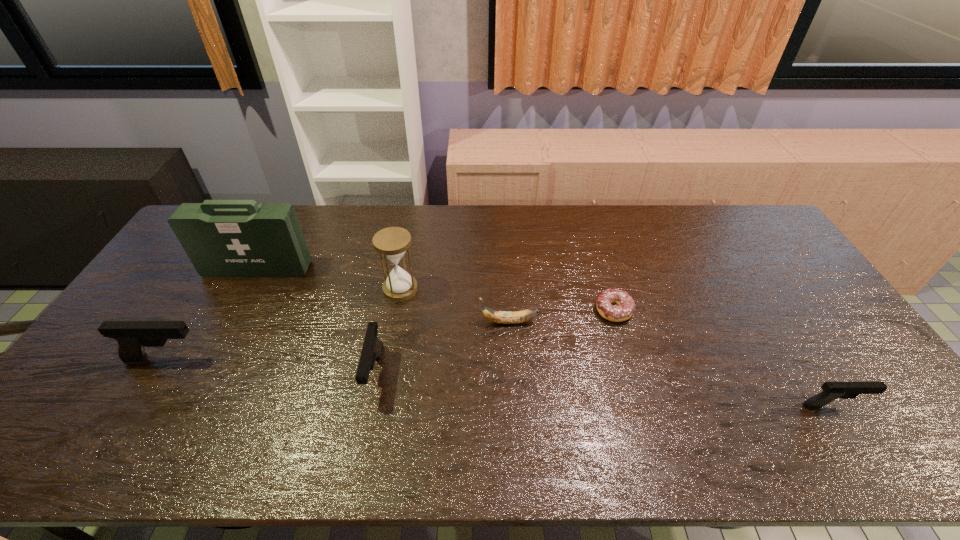
Please determine a free point for an extra pistol to ensure balance. Please provide its 2D coordinates. Your answer should be formatted as a tuple, i.e. [(x, y)], where the tuple contains the x and y coordinates of a point satisfying the conditions above.

[(597, 389)]